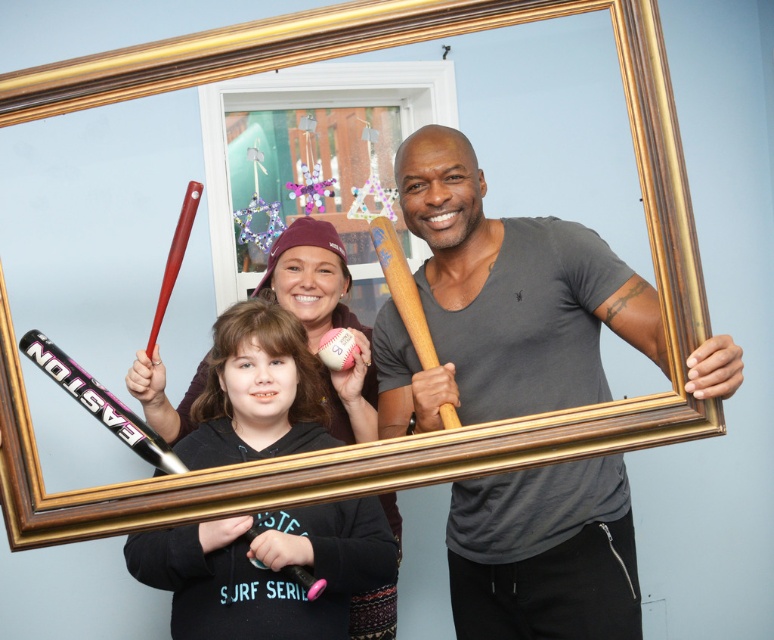
Which is more to the right, matte gray t-shirt at center or pink matte baseball bat at center?

matte gray t-shirt at center is more to the right.

Does matte gray t-shirt at center have a smaller size compared to pink matte baseball bat at center?

No.

Locate an element on the screen. This screenshot has width=774, height=640. matte gray t-shirt at center is located at coordinates (499, 301).

Does wooden baseball bat at center have a lesser width compared to matte red baseball bat at upper left?

No.

Can you confirm if wooden baseball bat at center is positioned to the right of matte red baseball bat at upper left?

Indeed, wooden baseball bat at center is positioned on the right side of matte red baseball bat at upper left.

Is point (423, 340) behind point (170, 284)?

No, (423, 340) is closer to viewer.

Locate an element on the screen. The image size is (774, 640). wooden baseball bat at center is located at coordinates (402, 289).

Based on the photo, can you confirm if pink matte baseball bat at center is positioned above matte red baseball bat at upper left?

No, pink matte baseball bat at center is not above matte red baseball bat at upper left.

Is point (281, 545) less distant than point (151, 340)?

Yes, point (281, 545) is in front of point (151, 340).

Is point (192, 612) farther from viewer compared to point (194, 200)?

No.

This screenshot has width=774, height=640. Find the location of `pink matte baseball bat at center`. pink matte baseball bat at center is located at coordinates (269, 570).